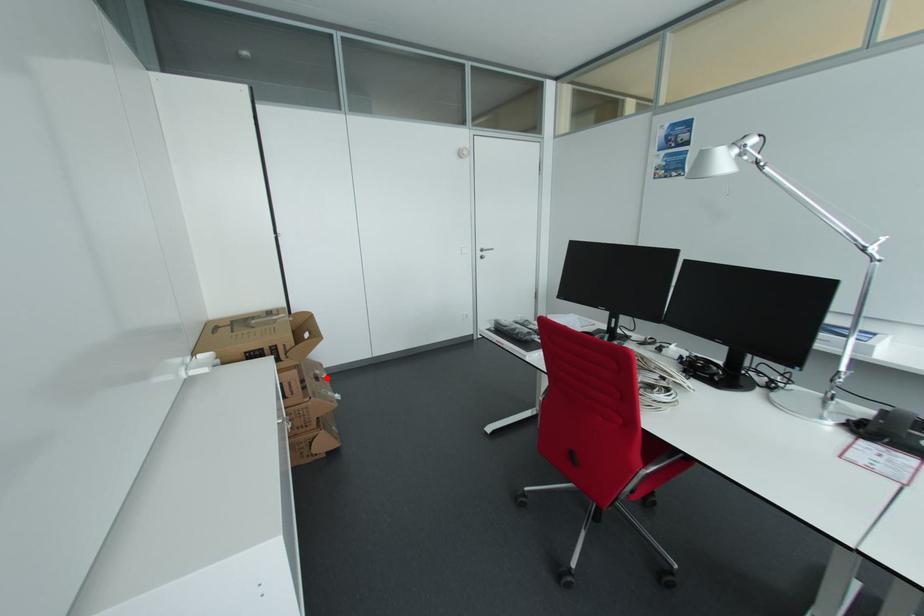
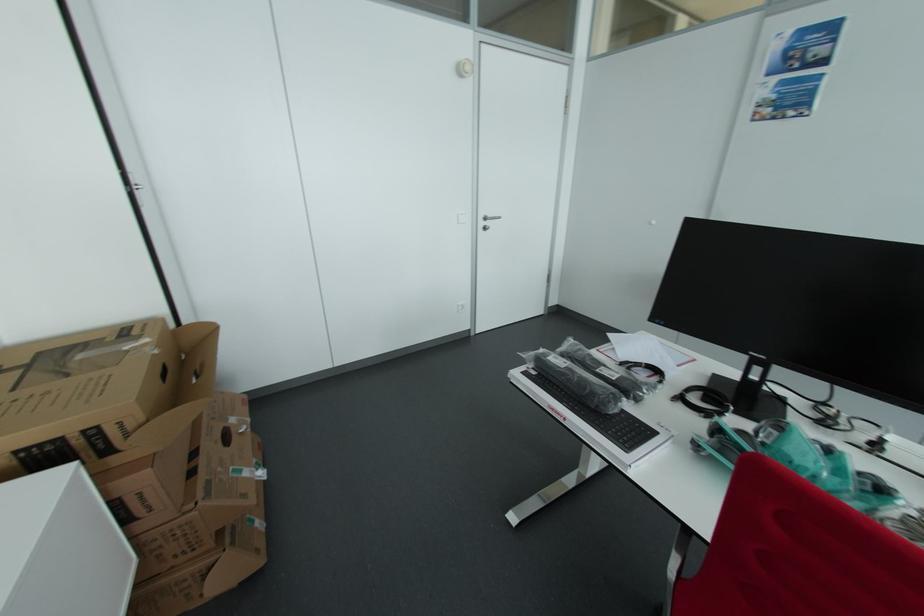
Question: I am providing you with two images of the same scene from different viewpoints. A red point is shown in image1. For the corresponding object point in image2, is it positioned nearer or farther from the camera?

Choices:
 (A) Nearer
 (B) Farther

Answer: (B)